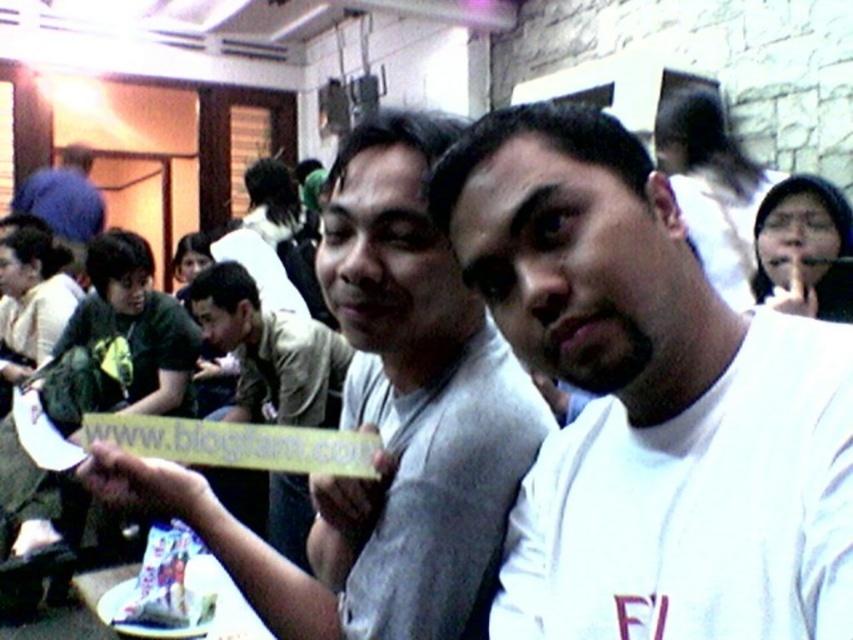
Question: Is smooth skin face at upper right behind white paper plate at lower center?

Choices:
 (A) no
 (B) yes

Answer: (B)

Question: Can you confirm if smooth skin face at upper right is positioned below white paper bag at lower left?

Choices:
 (A) yes
 (B) no

Answer: (B)

Question: Is smooth skin face at upper right closer to camera compared to white paper bag at lower left?

Choices:
 (A) yes
 (B) no

Answer: (B)

Question: Which point is farther to the camera?

Choices:
 (A) (318, 552)
 (B) (120, 605)
 (C) (820, 244)

Answer: (C)

Question: Among these objects, which one is nearest to the camera?

Choices:
 (A) gray fabric shirt at center
 (B) white paper plate at lower center

Answer: (A)

Question: Among these points, which one is farthest from the camera?

Choices:
 (A) (469, 141)
 (B) (245, 563)

Answer: (B)